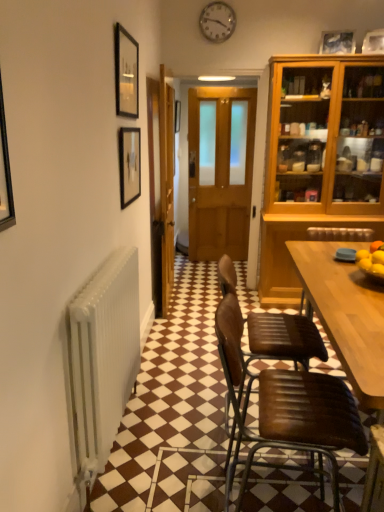
At what (x,y) coordinates should I click in order to perform the action: click on vacant area on top of brown leather chair at center, which is the 1th chair in back-to-front order (from a real-world perspective). Please return your answer as a coordinate pair (x, y). Image resolution: width=384 pixels, height=512 pixels. Looking at the image, I should click on click(x=311, y=262).